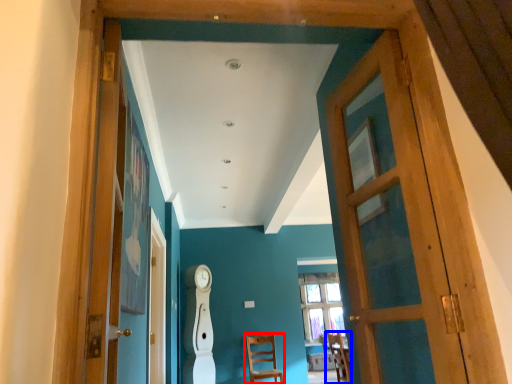
Question: Which object appears closest to the camera in this image, chair (highlighted by a red box) or chair (highlighted by a blue box)?

Choices:
 (A) chair
 (B) chair

Answer: (B)